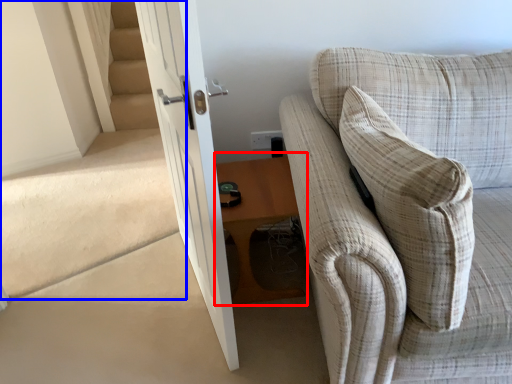
Question: Which object is further to the camera taking this photo, table (highlighted by a red box) or stairwell (highlighted by a blue box)?

Choices:
 (A) table
 (B) stairwell

Answer: (A)